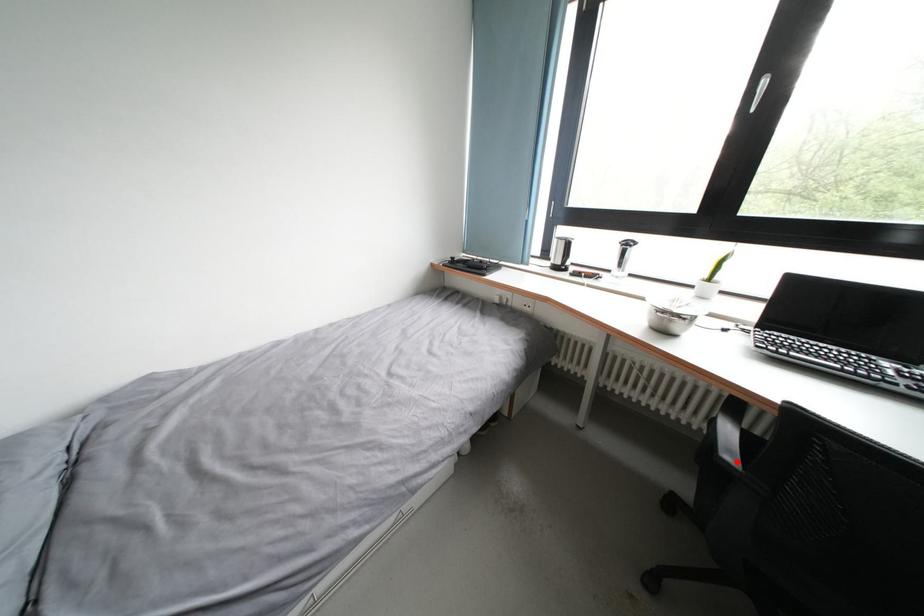
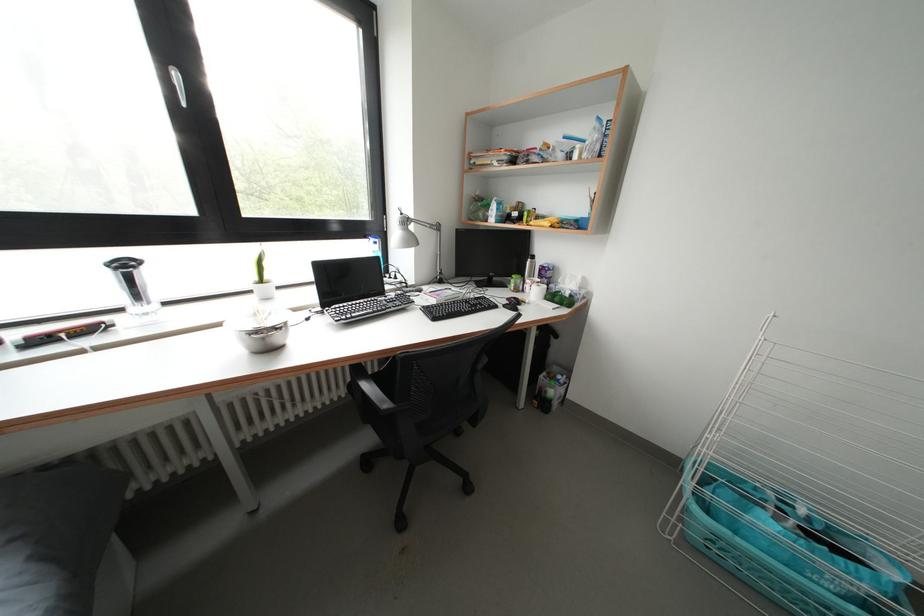
The point at the highlighted location is marked in the first image. Where is the corresponding point in the second image?

(392, 410)